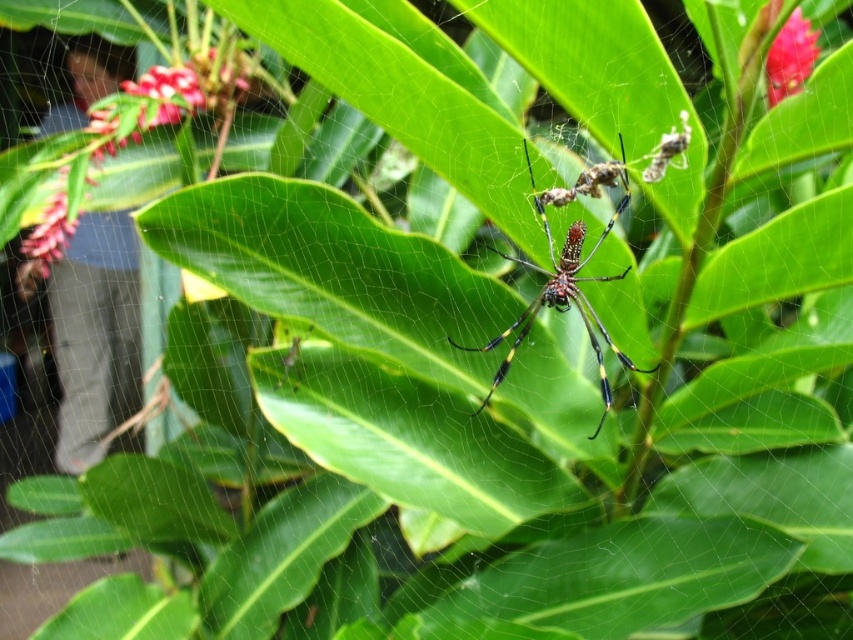
Question: Which object appears closest to the camera in this image?

Choices:
 (A) glossy pink flower at upper right
 (B) shiny metallic spider at center
 (C) glossy pink flower at upper left

Answer: (B)

Question: Does glossy pink flower at upper left appear over glossy pink flower at upper right?

Choices:
 (A) yes
 (B) no

Answer: (B)

Question: Does shiny metallic spider at center have a smaller size compared to glossy pink flower at upper right?

Choices:
 (A) yes
 (B) no

Answer: (B)

Question: Which point is farther to the camera?

Choices:
 (A) glossy pink flower at upper left
 (B) glossy pink flower at upper right

Answer: (A)

Question: Is shiny metallic spider at center below glossy pink flower at upper right?

Choices:
 (A) yes
 (B) no

Answer: (A)

Question: Which of the following is the farthest from the observer?

Choices:
 (A) shiny metallic spider at center
 (B) glossy pink flower at upper right

Answer: (B)